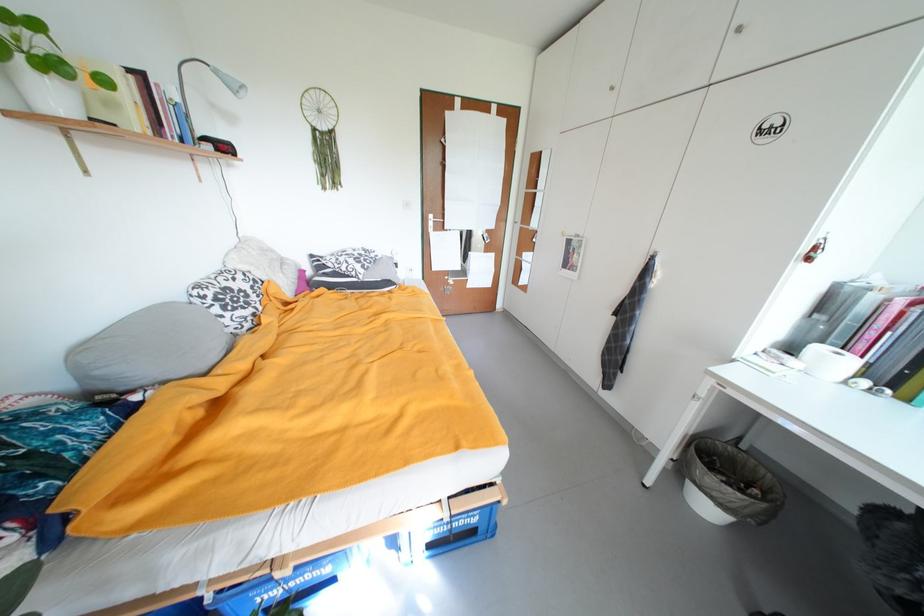
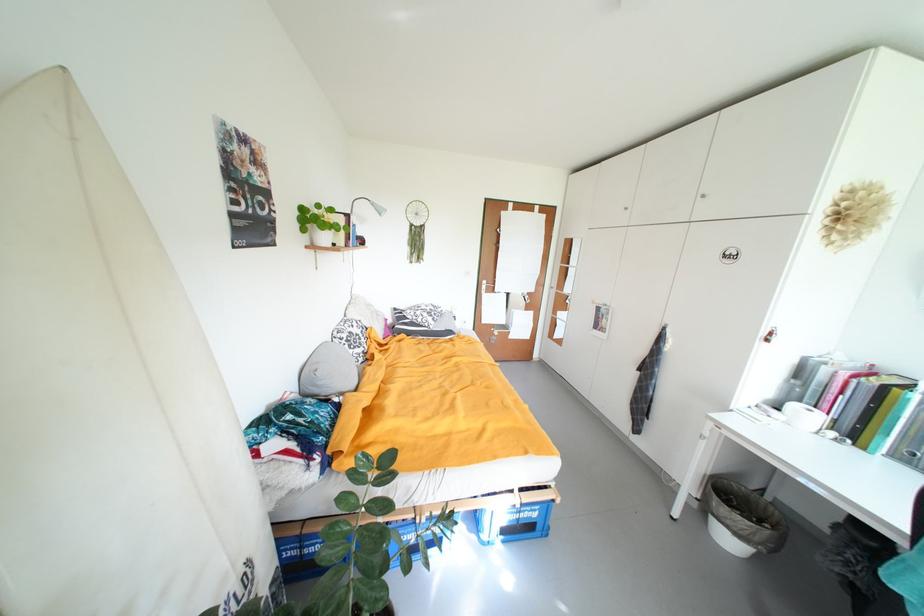
The point at (312, 273) is marked in the first image. Where is the corresponding point in the second image?

(394, 322)